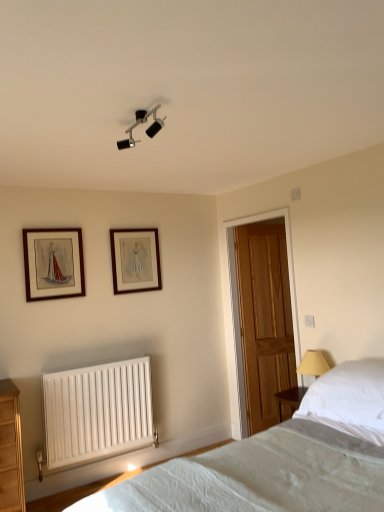
Question: Is wooden door at center thinner than white fabric bed at lower right?

Choices:
 (A) yes
 (B) no

Answer: (A)

Question: Can you confirm if wooden door at center is positioned to the left of white fabric bed at lower right?

Choices:
 (A) no
 (B) yes

Answer: (A)

Question: Is the depth of wooden door at center less than that of white fabric bed at lower right?

Choices:
 (A) yes
 (B) no

Answer: (B)

Question: Is wooden door at center directly adjacent to white fabric bed at lower right?

Choices:
 (A) yes
 (B) no

Answer: (B)

Question: Considering the relative positions of wooden door at center and white fabric bed at lower right in the image provided, is wooden door at center to the right of white fabric bed at lower right from the viewer's perspective?

Choices:
 (A) no
 (B) yes

Answer: (B)

Question: Could you tell me if wooden door at center is turned towards white fabric bed at lower right?

Choices:
 (A) no
 (B) yes

Answer: (A)

Question: From the image's perspective, is white soft pillow at right under wooden door at center?

Choices:
 (A) no
 (B) yes

Answer: (B)

Question: From the image's perspective, is white soft pillow at right above wooden door at center?

Choices:
 (A) no
 (B) yes

Answer: (A)

Question: Can you confirm if white soft pillow at right is thinner than wooden door at center?

Choices:
 (A) yes
 (B) no

Answer: (B)

Question: Considering the relative sizes of white soft pillow at right and wooden door at center in the image provided, is white soft pillow at right wider than wooden door at center?

Choices:
 (A) yes
 (B) no

Answer: (A)

Question: Considering the relative positions of white soft pillow at right and wooden door at center in the image provided, is white soft pillow at right to the right of wooden door at center from the viewer's perspective?

Choices:
 (A) yes
 (B) no

Answer: (A)

Question: Is white soft pillow at right further to camera compared to wooden door at center?

Choices:
 (A) no
 (B) yes

Answer: (A)

Question: Does wooden framed picture at upper left, which is counted as the second picture frame, starting from the back, have a larger size compared to white fabric bed at lower right?

Choices:
 (A) no
 (B) yes

Answer: (A)